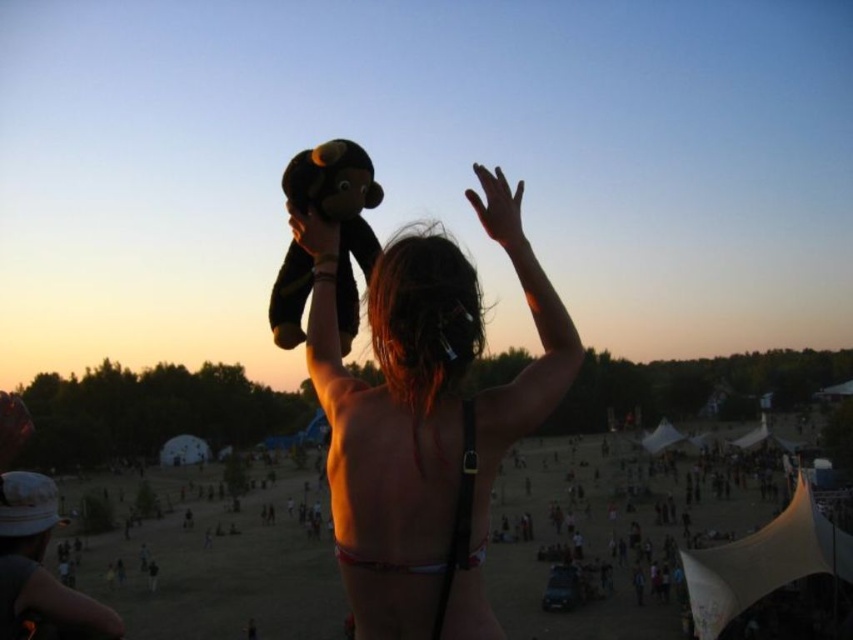
Question: Can you confirm if soft plush monkey at upper center is positioned to the left of white matte bikini top at upper center?

Choices:
 (A) yes
 (B) no

Answer: (A)

Question: Based on their relative distances, which object is farther from the soft plush monkey at upper center?

Choices:
 (A) white matte bikini top at upper center
 (B) matte black plush monkey at upper center

Answer: (A)

Question: Can you confirm if soft plush monkey at upper center is bigger than white matte bikini top at upper center?

Choices:
 (A) yes
 (B) no

Answer: (A)

Question: Observing the image, what is the correct spatial positioning of matte black plush monkey at upper center in reference to white matte bikini top at upper center?

Choices:
 (A) left
 (B) right

Answer: (B)

Question: Which object is positioned farthest from the soft plush monkey at upper center?

Choices:
 (A) white matte bikini top at upper center
 (B) matte black plush monkey at upper center

Answer: (A)

Question: Based on their relative distances, which object is farther from the white matte bikini top at upper center?

Choices:
 (A) soft plush monkey at upper center
 (B) matte black plush monkey at upper center

Answer: (A)